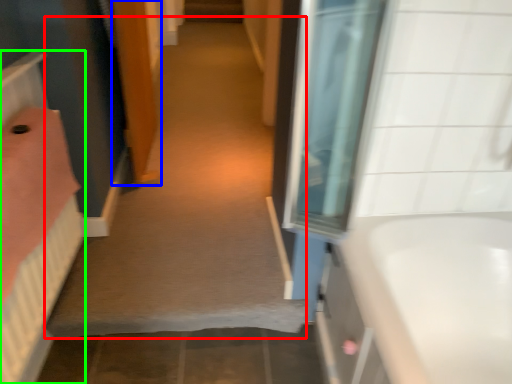
Question: Considering the real-world distances, which object is closest to plain (highlighted by a red box)? door (highlighted by a blue box) or bed (highlighted by a green box).

Choices:
 (A) door
 (B) bed

Answer: (A)